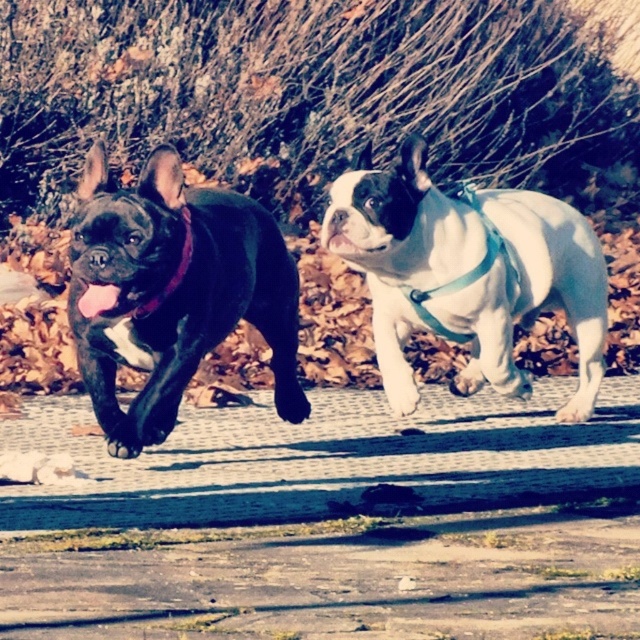
What do you see at coordinates (531, 296) in the screenshot? Image resolution: width=640 pixels, height=640 pixels. I see `white matte french bulldog at center` at bounding box center [531, 296].

Is white matte french bulldog at center above pink matte tongue at center?

Yes.

Which is behind, point (445, 298) or point (106, 289)?

Point (445, 298)

The height and width of the screenshot is (640, 640). What are the coordinates of `white matte french bulldog at center` in the screenshot? It's located at (531, 296).

Who is positioned more to the left, white matte french bulldog at center or purple fabric neckband at left?

Positioned to the left is purple fabric neckband at left.

Which is above, white matte french bulldog at center or purple fabric neckband at left?

purple fabric neckband at left is higher up.

Where is `white matte french bulldog at center`? The height and width of the screenshot is (640, 640). white matte french bulldog at center is located at coordinates (531, 296).

Is shiny black dog at left above pink matte tongue at center?

No, shiny black dog at left is not above pink matte tongue at center.

Is point (275, 292) positioned before point (113, 304)?

No, it is not.

Is point (104, 400) positioned after point (109, 300)?

Yes, it is.

Where is `shiny black dog at left`? Image resolution: width=640 pixels, height=640 pixels. shiny black dog at left is located at coordinates (173, 291).